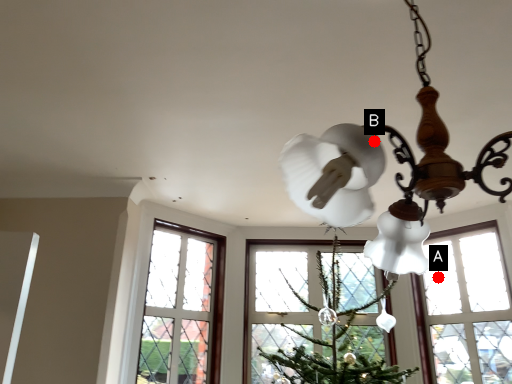
Question: Two points are circled on the image, labeled by A and B beside each circle. Which point is farther from the camera taking this photo?

Choices:
 (A) A is further
 (B) B is further

Answer: (A)